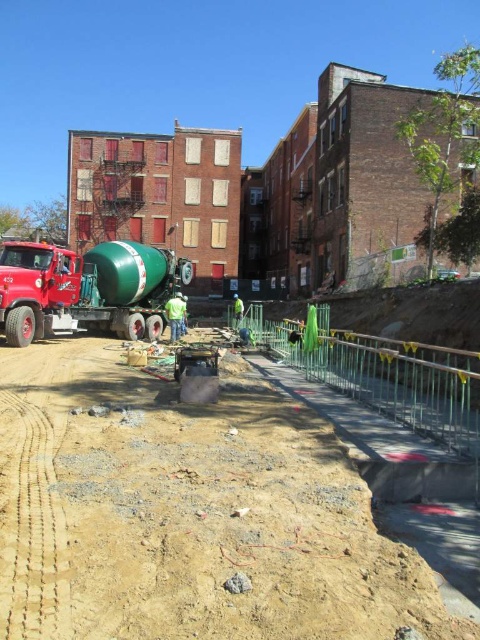
You are a delivery truck driver who needs to navigate through the construction site. You see the brown sandy dirt track at lower center and the green fabric construction worker at center. Which object is located to the right of the other?

The brown sandy dirt track at lower center is positioned on the right side of green fabric construction worker at center.

You are a delivery driver with a truck that has a minimum turning radius of 4 meters. You need to navigate your truck into the construction site shown in the image. Can you safely turn your truck onto the brown sandy dirt track at lower center from your current position?

The distance between the brown sandy dirt track at lower center and the camera is 3.04 meters. Since the truck requires a minimum turning radius of 4 meters, it is not possible to safely turn the truck onto the track from the current position as the available space is insufficient.

You are a delivery driver who needs to park your truck exactly at the coordinates where the green matte trailer truck at center is currently parked. According to the image, what are the exact coordinates you should aim for?

The exact coordinates for the green matte trailer truck at center are 0.452 in the x direction and 0.181 in the y direction.